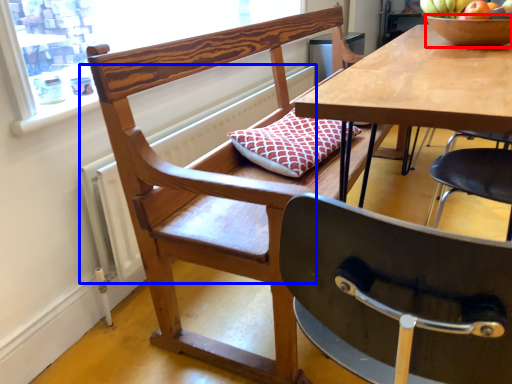
Question: Which object is closer to the camera taking this photo, bowl (highlighted by a red box) or radiator (highlighted by a blue box)?

Choices:
 (A) bowl
 (B) radiator

Answer: (B)